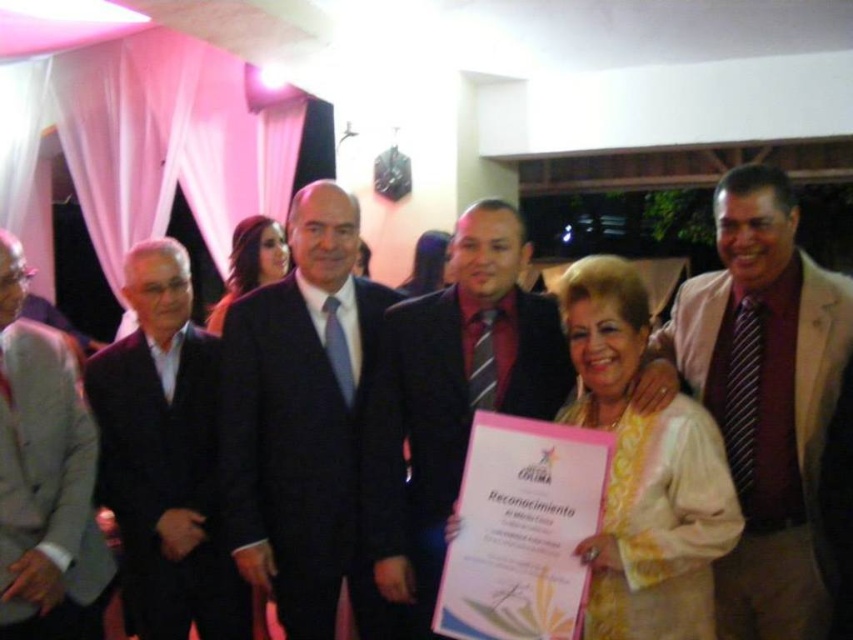
Is dark suit at center to the right of matte gold necklace at center from the viewer's perspective?

Correct, you'll find dark suit at center to the right of matte gold necklace at center.

Can you confirm if dark suit at center is wider than matte gold necklace at center?

Correct, the width of dark suit at center exceeds that of matte gold necklace at center.

Identify the location of dark suit at center. (468, 374).

Who is more forward, (x=397, y=486) or (x=431, y=259)?

Point (x=397, y=486) is in front.

Does black suit at center have a greater width compared to matte gold necklace at center?

Yes.

Locate an element on the screen. black suit at center is located at coordinates (314, 432).

Is the position of beige textured suit at right more distant than that of dark suit at center?

That is False.

Between beige textured suit at right and dark suit at center, which one has less height?

dark suit at center

Who is more forward, (811, 369) or (556, 365)?

Positioned in front is point (811, 369).

Find the location of a particular element. The width and height of the screenshot is (853, 640). beige textured suit at right is located at coordinates (761, 396).